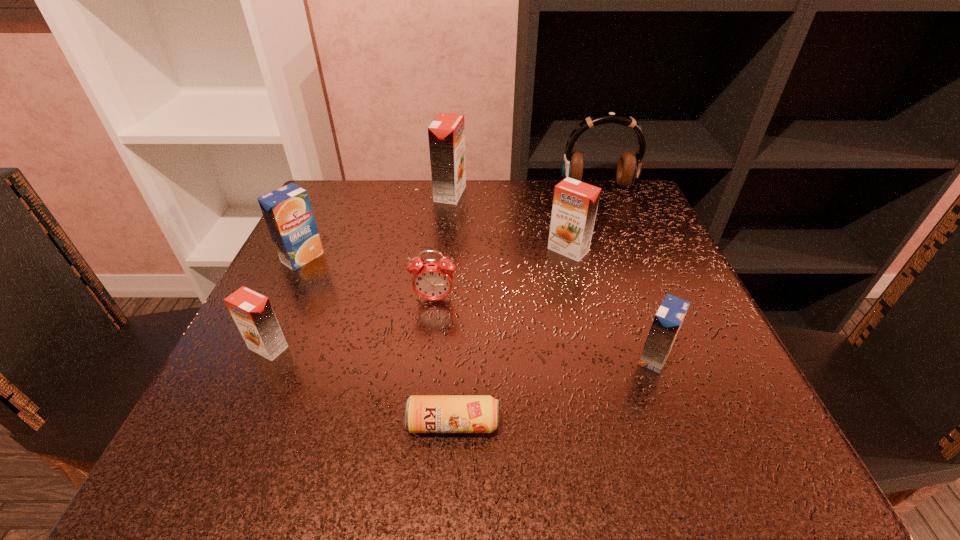
Locate an element on the screen. free spot located on the front of the nearer blue orange_juice is located at coordinates (688, 450).

Find the location of a particular element. Image resolution: width=960 pixels, height=540 pixels. free space located on the right of the nearest orange orange juice is located at coordinates (339, 348).

The height and width of the screenshot is (540, 960). In order to click on free space located 0.070m on the left of the nearest object in this screenshot , I will do `click(357, 424)`.

Find the location of `headset that is at the far edge`. headset that is at the far edge is located at coordinates (629, 166).

Identify the location of orange juice that is at the far edge. The height and width of the screenshot is (540, 960). (446, 133).

Image resolution: width=960 pixels, height=540 pixels. I want to click on object situated at the near edge, so click(423, 413).

Find the location of a particular element. Image resolution: width=960 pixels, height=540 pixels. headset at the right edge is located at coordinates (629, 166).

This screenshot has width=960, height=540. I want to click on orange_juice that is at the right edge, so click(x=667, y=322).

The image size is (960, 540). In order to click on object that is at the far right corner in this screenshot , I will do `click(629, 166)`.

Identify the location of free space at the far edge. (399, 193).